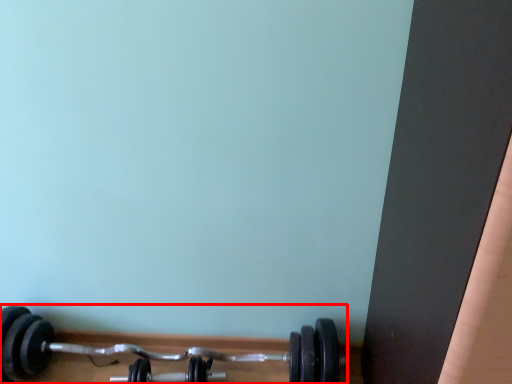
Question: Considering the relative positions of dumbbell (annotated by the red box) and dumbbell in the image provided, where is dumbbell (annotated by the red box) located with respect to the staircase?

Choices:
 (A) left
 (B) right

Answer: (A)